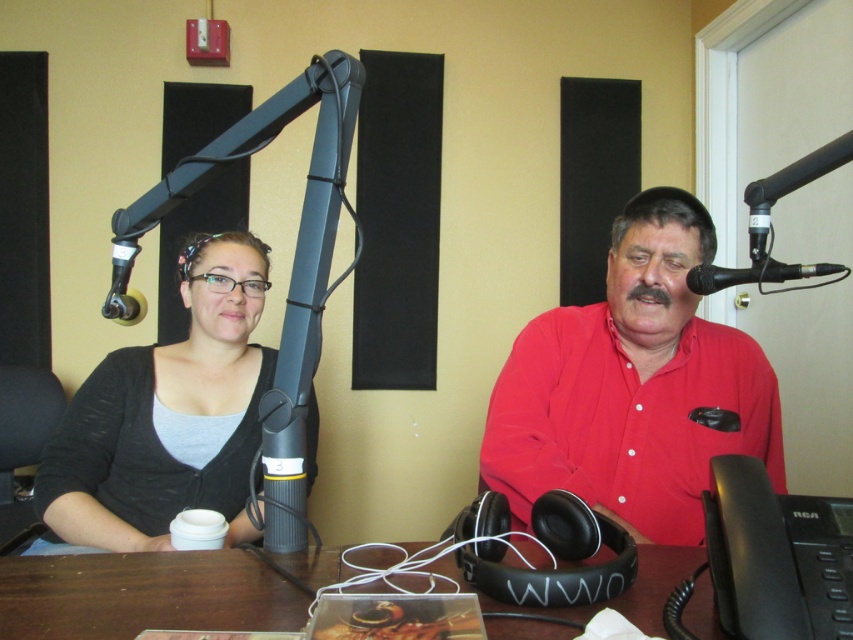
You are designing a layout for a magazine cover featuring the two individuals from the scene. The matte red shirt at center and the matte gray cardigan at left must be included. Based on their sizes in the original image, which clothing item should you prioritize placing first to ensure both fit well on the cover?

The matte red shirt at center occupies less space than the matte gray cardigan at left, so you should prioritize placing the matte gray cardigan at left first to accommodate its larger size before fitting the smaller matte red shirt at center into the remaining space.

You are a photographer standing in front of the desk. You need to take a photo of both the matte red shirt at center and the matte gray cardigan at left. Which one should you focus on first if you want to capture both in the same frame without moving the camera?

The matte red shirt at center is positioned on the right side of matte gray cardigan at left, so you should focus on the matte gray cardigan at left first to ensure both are in frame.

You are an interior designer assessing a radio studio setup. You need to determine if the matte red shirt at center can be moved to another location without disturbing the brown wooden table at center. Based on their current arrangement, is this possible?

The matte red shirt at center is positioned over the brown wooden table at center, so moving it would require lifting it from the table, which doesn not disturb the table itself. Therefore, yes, it can be moved without affecting the table.